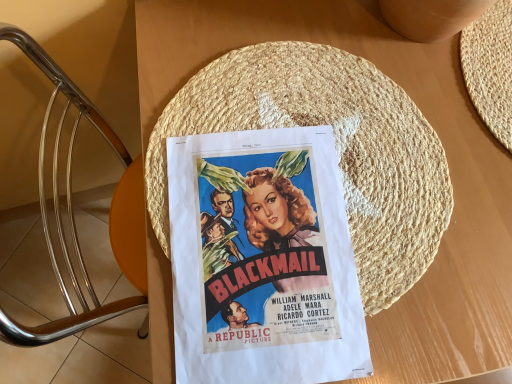
You are a GUI agent. You are given a task and a screenshot of the screen. Output one action in this format:
    pyautogui.click(x=<x>, y=<y>)
    Task: Click on the free space above natural straw hat at center (from a real-world perspective)
    This screenshot has height=384, width=512.
    Given the screenshot: What is the action you would take?
    pyautogui.click(x=304, y=175)